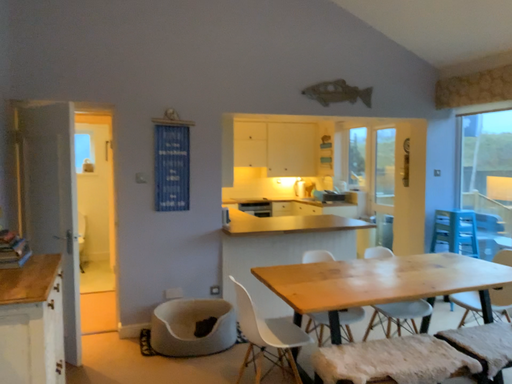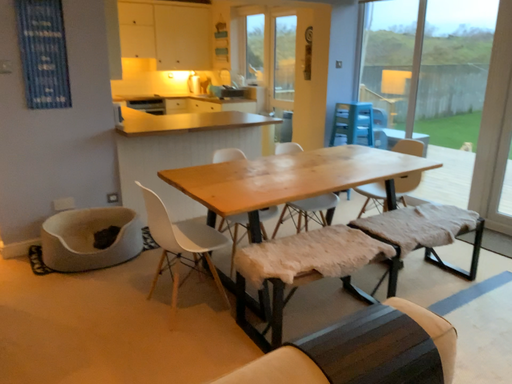
Question: Which way did the camera rotate in the video?

Choices:
 (A) rotated left
 (B) rotated right

Answer: (B)